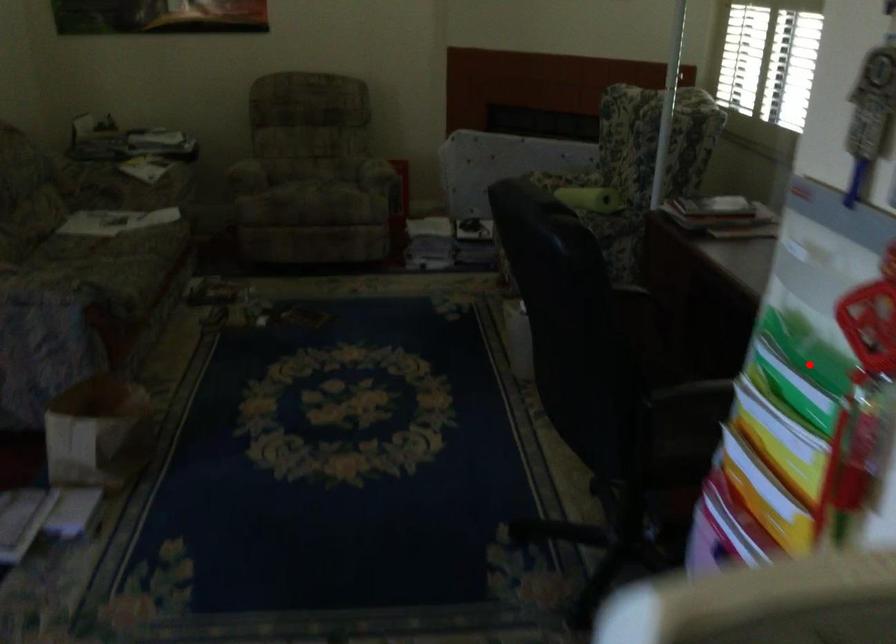
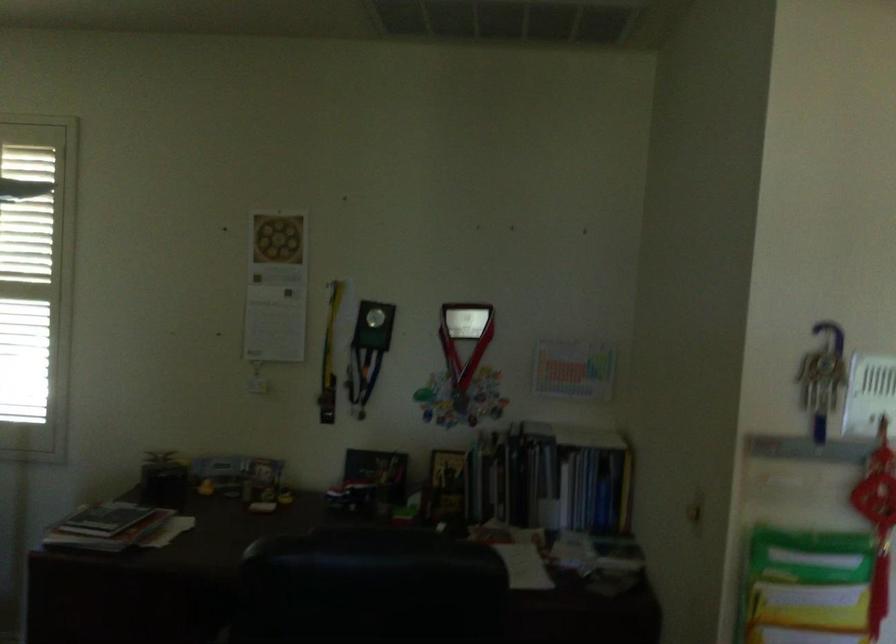
Question: I am providing you with two images of the same scene from different viewpoints. Given a red point in image1, look at the same physical point in image2. Is it:

Choices:
 (A) Closer to the viewpoint
 (B) Farther from the viewpoint

Answer: (B)